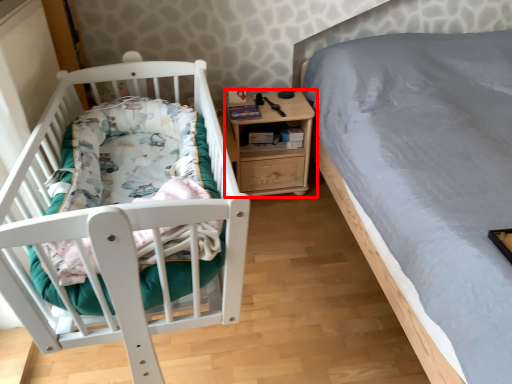
Question: Where is nightstand (annotated by the red box) located in relation to infant bed in the image?

Choices:
 (A) left
 (B) right

Answer: (B)